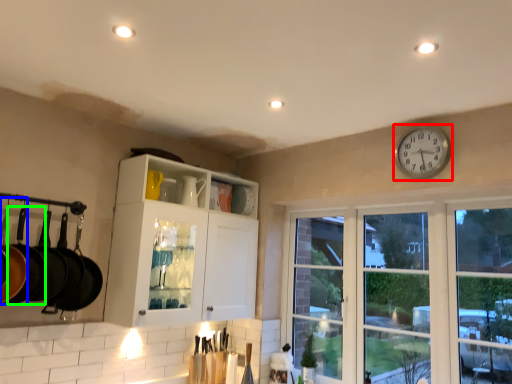
Question: Considering the real-world distances, which object is farthest from clock (highlighted by a red box)? frying pan (highlighted by a blue box) or frying pan (highlighted by a green box)?

Choices:
 (A) frying pan
 (B) frying pan

Answer: (A)